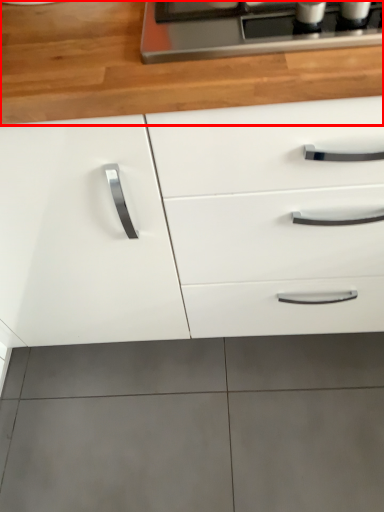
Question: Considering the relative positions of countertop (annotated by the red box) and cabinetry in the image provided, where is countertop (annotated by the red box) located with respect to the staircase?

Choices:
 (A) left
 (B) right

Answer: (B)